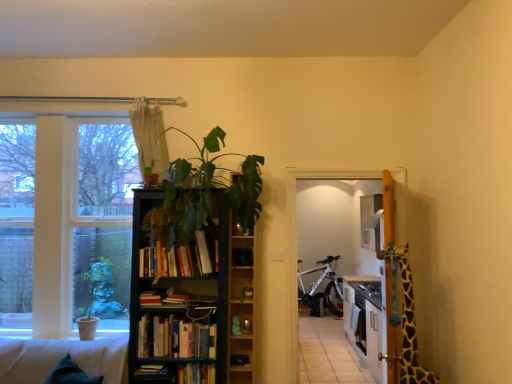
Describe the element at coordinates (191, 298) in the screenshot. This screenshot has height=384, width=512. I see `dark wood bookcase at center` at that location.

What do you see at coordinates (209, 187) in the screenshot?
I see `green leafy plant at center` at bounding box center [209, 187].

Describe the element at coordinates (61, 358) in the screenshot. I see `waffle-textured white couch at lower left` at that location.

At what (x,y) coordinates should I click in order to perform the action: click on dark wood bookcase at center. Please return your answer as a coordinate pair (x, y). Image resolution: width=512 pixels, height=384 pixels. Looking at the image, I should click on (191, 298).

Is dark wood bookcase at center facing away from hardcover book at center, which is counted as the 4th book, starting from the top?

Yes, dark wood bookcase at center's orientation is away from hardcover book at center, which is counted as the 4th book, starting from the top.

This screenshot has width=512, height=384. I want to click on book that is the 2nd one when counting leftward from the dark wood bookcase at center, so click(155, 374).

Which object is positioned more to the right, dark wood bookcase at center or hardcover book at center, which is the 1th book in bottom-to-top order?

Positioned to the right is dark wood bookcase at center.

Which object is further away from the camera, beige fabric curtain at upper center or dark wood bookcase at center?

beige fabric curtain at upper center is behind.

Does beige fabric curtain at upper center have a lesser height compared to dark wood bookcase at center?

Yes, beige fabric curtain at upper center is shorter than dark wood bookcase at center.

Where is `curtain positioned vertically above the dark wood bookcase at center (from a real-world perspective)`? The image size is (512, 384). curtain positioned vertically above the dark wood bookcase at center (from a real-world perspective) is located at coordinates (150, 139).

Considering the positions of objects beige fabric curtain at upper center and dark wood bookcase at center in the image provided, who is more to the right, beige fabric curtain at upper center or dark wood bookcase at center?

dark wood bookcase at center.

Is hardcover books at center, marked as the fourth book in a bottom-to-top arrangement, at the left side of hardcover books at center, the 2th book in the top-to-bottom sequence?

No, hardcover books at center, marked as the fourth book in a bottom-to-top arrangement, is not to the left of hardcover books at center, the 2th book in the top-to-bottom sequence.

Which point is more forward, (149, 258) or (160, 326)?

Result: Positioned in front is point (149, 258).

Which of these two, hardcover books at center, marked as the fourth book in a bottom-to-top arrangement, or hardcover books at center, the third book when ordered from bottom to top, is wider?

hardcover books at center, marked as the fourth book in a bottom-to-top arrangement.

Considering the relative sizes of beige fabric curtain at upper center and waffle-textured white couch at lower left in the image provided, is beige fabric curtain at upper center shorter than waffle-textured white couch at lower left?

No, beige fabric curtain at upper center is not shorter than waffle-textured white couch at lower left.

From the image's perspective, which one is positioned lower, beige fabric curtain at upper center or waffle-textured white couch at lower left?

waffle-textured white couch at lower left.

Considering the relative sizes of beige fabric curtain at upper center and waffle-textured white couch at lower left in the image provided, is beige fabric curtain at upper center thinner than waffle-textured white couch at lower left?

Indeed, beige fabric curtain at upper center has a lesser width compared to waffle-textured white couch at lower left.

Looking at this image, could you tell me if beige fabric curtain at upper center is facing waffle-textured white couch at lower left?

No, beige fabric curtain at upper center is not aimed at waffle-textured white couch at lower left.

Measure the distance from white matte bicycle at center to green leafy plant at center.

white matte bicycle at center and green leafy plant at center are 3.48 meters apart from each other.

From the image's perspective, which object appears higher, white matte bicycle at center or green leafy plant at center?

green leafy plant at center is shown above in the image.

Would you say white matte bicycle at center is a long distance from green leafy plant at center?

That's right, there is a large distance between white matte bicycle at center and green leafy plant at center.

Which point is more forward, (325, 303) or (206, 187)?

Positioned in front is point (206, 187).

Can you confirm if white matte bicycle at center is thinner than hardcover book at center, which is counted as the 4th book, starting from the top?

No.

From the image's perspective, would you say white matte bicycle at center is shown under hardcover book at center, which is counted as the 4th book, starting from the top?

Yes, from the image's perspective, white matte bicycle at center is below hardcover book at center, which is counted as the 4th book, starting from the top.

Considering the positions of point (331, 282) and point (173, 365), is point (331, 282) closer or farther from the camera than point (173, 365)?

Clearly, point (331, 282) is more distant from the camera than point (173, 365).

Does wooden shelf at center have a lesser width compared to dark wood bookcase at center?

Yes.

Is wooden shelf at center facing towards dark wood bookcase at center?

No, wooden shelf at center does not turn towards dark wood bookcase at center.

At what (x,y) coordinates should I click in order to perform the action: click on bookcase positioned vertically above the hardcover book at center, which is counted as the 4th book, starting from the top (from a real-world perspective). Please return your answer as a coordinate pair (x, y). Looking at the image, I should click on point(191,298).

Locate an element on the screen. The image size is (512, 384). bookcase below the beige fabric curtain at upper center (from the image's perspective) is located at coordinates (191, 298).

Based on their spatial positions, is dark wood bookcase at center or beige fabric curtain at upper center further from waffle-textured white couch at lower left?

The object further to waffle-textured white couch at lower left is beige fabric curtain at upper center.

Looking at the image, which one is located further to white matte bicycle at center, hardcover book at center, which is the 1th book in bottom-to-top order, or waffle-textured white couch at lower left?

waffle-textured white couch at lower left.

Looking at the image, which one is located further to beige fabric curtain at upper center, waffle-textured white couch at lower left or white glass window at left?

waffle-textured white couch at lower left is positioned further to the anchor beige fabric curtain at upper center.

Estimate the real-world distances between objects in this image. Which object is closer to dark wood bookcase at center, hardcover book at center, which is counted as the 4th book, starting from the top, or hardcover book at center, arranged as the third book when viewed from the top?

Among the two, hardcover book at center, arranged as the third book when viewed from the top, is located nearer to dark wood bookcase at center.

Which object lies nearer to the anchor point beige fabric curtain at upper center, wooden shelf at center or hardcover book at center, which ranks as the 2th book in bottom-to-top order?

The object closer to beige fabric curtain at upper center is wooden shelf at center.

Which object lies further to the anchor point white matte bicycle at center, waffle-textured white couch at lower left or hardcover books at center, the third book when ordered from bottom to top?

The object further to white matte bicycle at center is waffle-textured white couch at lower left.

Looking at the image, which one is located further to hardcover book at center, which is the 1th book in bottom-to-top order, white matte bicycle at center or beige fabric curtain at upper center?

The object further to hardcover book at center, which is the 1th book in bottom-to-top order, is white matte bicycle at center.

When comparing their distances from hardcover book at center, which is counted as the 4th book, starting from the top, does hardcover books at center, the 2th book in the top-to-bottom sequence, or white glass window at left seem closer?

hardcover books at center, the 2th book in the top-to-bottom sequence, is positioned closer to the anchor hardcover book at center, which is counted as the 4th book, starting from the top.

Locate an element on the screen. This screenshot has height=384, width=512. bookcase that lies between hardcover books at center, which is counted as the 1th book, starting from the top, and hardcover books at center, the third book when ordered from bottom to top, from top to bottom is located at coordinates (191, 298).

At what (x,y) coordinates should I click in order to perform the action: click on couch between beige fabric curtain at upper center and hardcover book at center, which is counted as the 4th book, starting from the top, in the vertical direction. Please return your answer as a coordinate pair (x, y). Image resolution: width=512 pixels, height=384 pixels. Looking at the image, I should click on (61, 358).

Where is `bookcase between green leafy plant at center and white matte bicycle at center from front to back`? This screenshot has width=512, height=384. bookcase between green leafy plant at center and white matte bicycle at center from front to back is located at coordinates (191, 298).

What are the coordinates of `curtain situated between white glass window at left and hardcover books at center, marked as the fourth book in a bottom-to-top arrangement, from left to right` in the screenshot? It's located at coord(150,139).